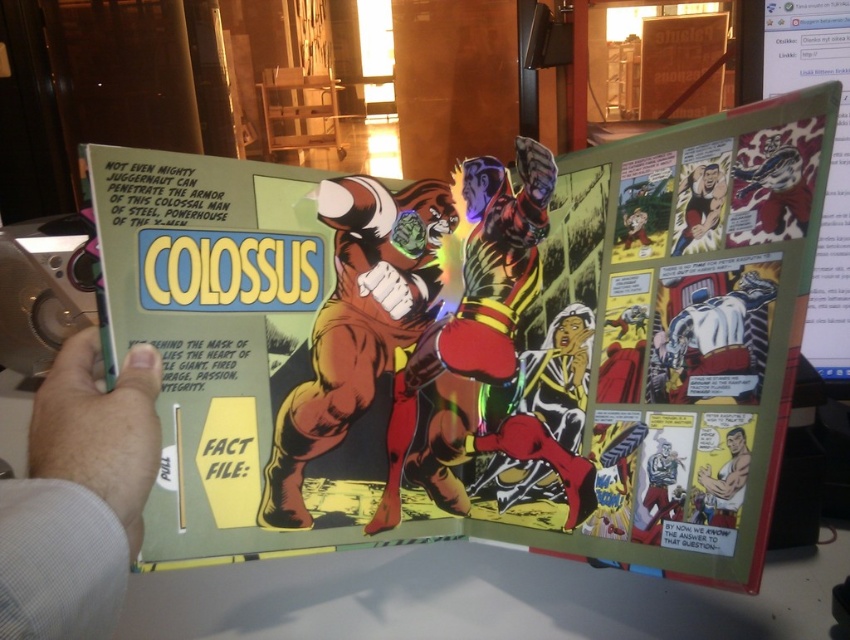
Can you confirm if shiny metallic armor at center is thinner than smooth skin man at lower right?

No, shiny metallic armor at center is not thinner than smooth skin man at lower right.

Who is positioned more to the left, shiny metallic armor at center or smooth skin man at lower right?

shiny metallic armor at center is more to the left.

Who is more forward, [536,182] or [748,456]?

Point [748,456]

Where is `shiny metallic armor at center`? shiny metallic armor at center is located at coordinates (477, 330).

Between matte plastic comic book at center and smooth black hair at upper right, which one is positioned higher?

smooth black hair at upper right

Which is in front, point (769, 472) or point (754, 234)?

Point (769, 472) is in front.

You are a GUI agent. You are given a task and a screenshot of the screen. Output one action in this format:
    pyautogui.click(x=<x>, y=<y>)
    Task: Click on the matte plastic comic book at center
    Image resolution: width=850 pixels, height=640 pixels.
    Given the screenshot: What is the action you would take?
    tap(462, 342)

Which is behind, point (429, 369) or point (703, 170)?

The point (429, 369) is more distant.

Does point (463, 240) lie in front of point (683, 188)?

No, it is not.

Where is `shiny metallic armor at center`? The width and height of the screenshot is (850, 640). shiny metallic armor at center is located at coordinates (477, 330).